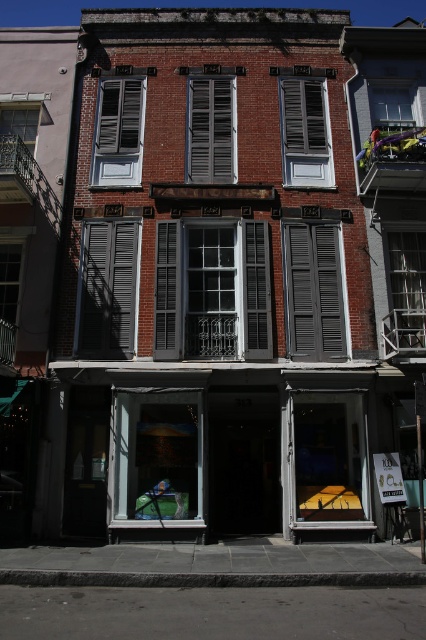
You are standing in front of the building and want to open the gray matte shutter at center. Considering your height is 1.7 meters, can you reach it without any tools?

The gray matte shutter at center is 11.73 meters away from viewer, which is too far to reach even with your height of 1.7 meters. You would need a ladder or other tool to reach it.

You are a window installer assessing the building. You need to replace the matte gray shutters at center and the clear glass window at upper right. Which object requires a wider replacement material?

The clear glass window at upper right requires wider replacement material since the matte gray shutters at center has a lesser width compared to clear glass window at upper right.